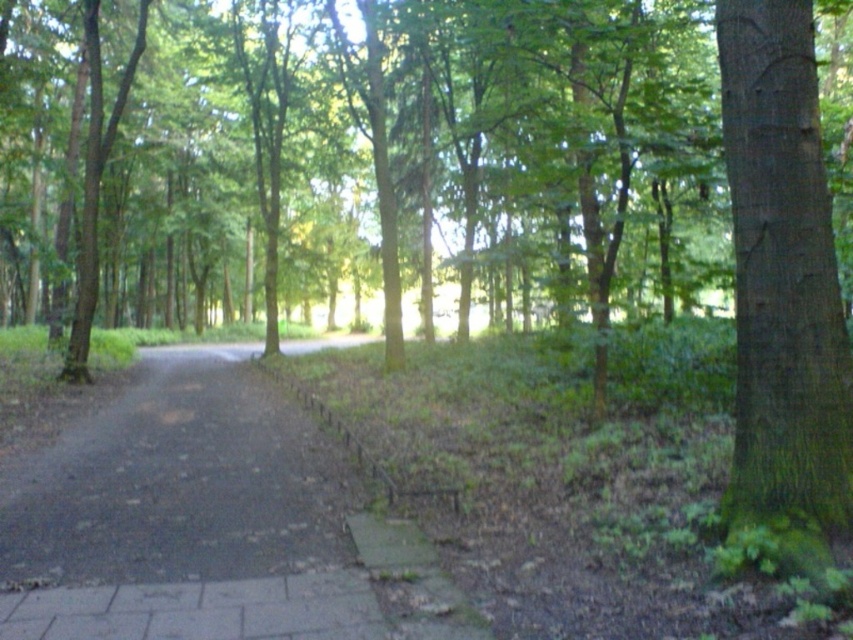
Question: Considering the relative positions of paved asphalt path at center and green mossy bark tree at right in the image provided, where is paved asphalt path at center located with respect to green mossy bark tree at right?

Choices:
 (A) left
 (B) right

Answer: (A)

Question: Which object is farther from the camera taking this photo?

Choices:
 (A) green mossy bark tree at right
 (B) paved asphalt path at center

Answer: (A)

Question: From the image, what is the correct spatial relationship of paved asphalt path at center in relation to green mossy bark tree at right?

Choices:
 (A) above
 (B) below

Answer: (B)

Question: Can you confirm if paved asphalt path at center is bigger than green mossy bark tree at right?

Choices:
 (A) yes
 (B) no

Answer: (A)